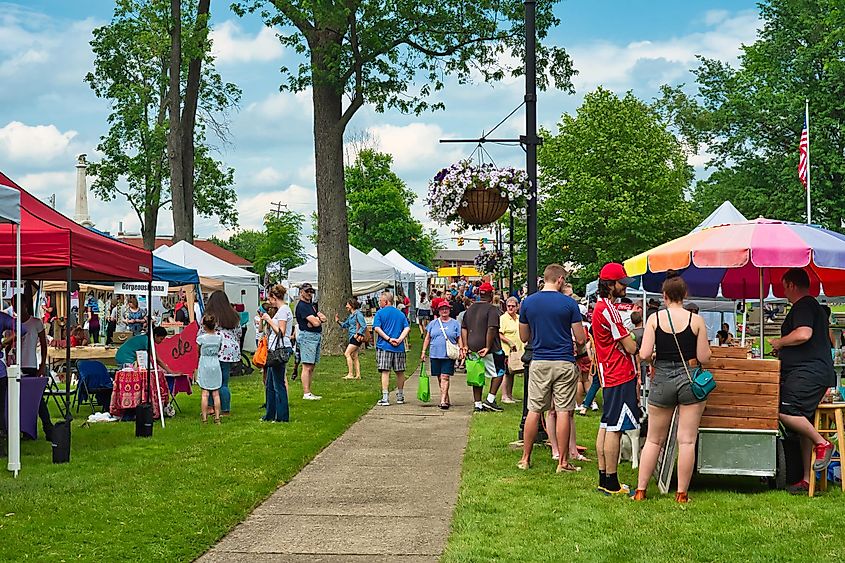
Where is `red canopy`? This screenshot has height=563, width=845. red canopy is located at coordinates (57, 245).